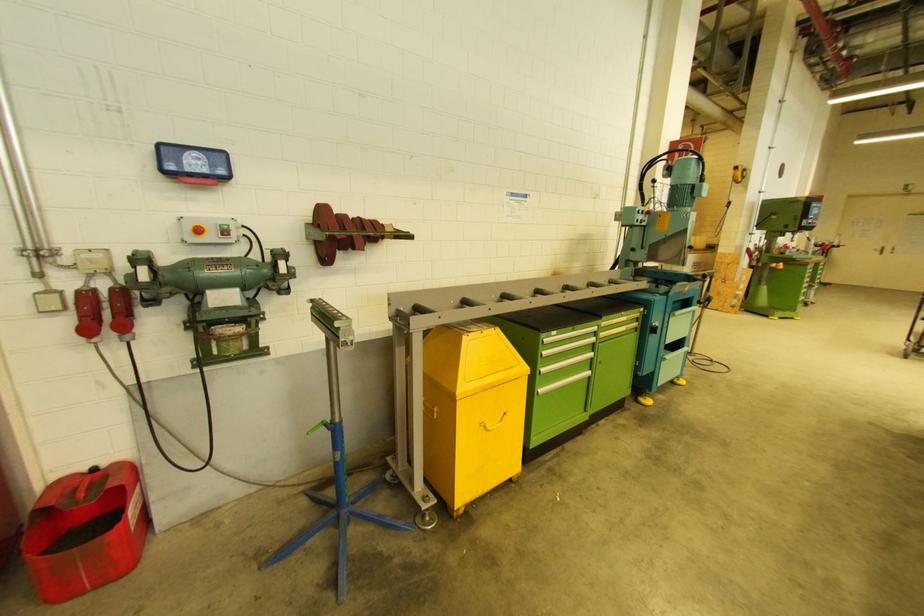
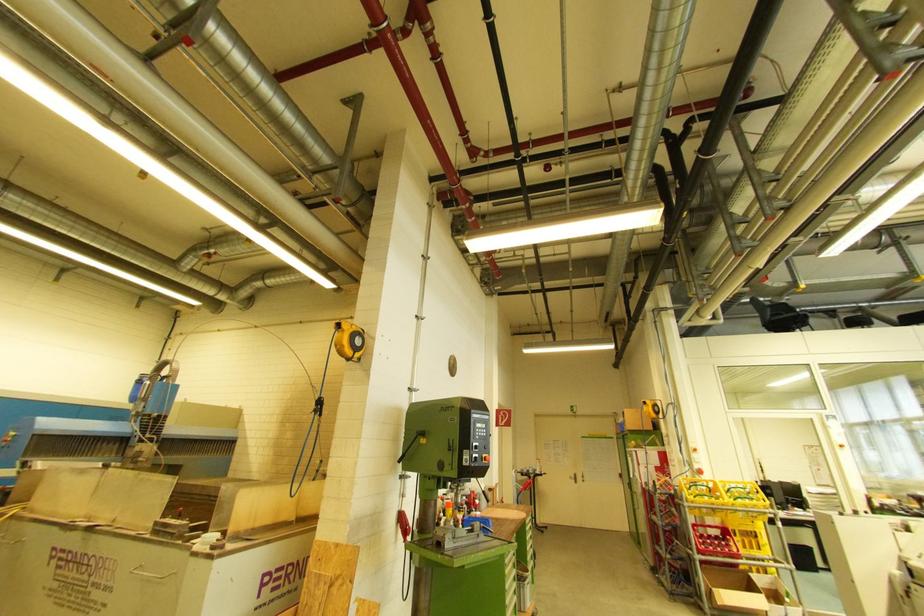
Where in the second image is the point corresponding to pixel 749 253 from the first image?

(404, 519)